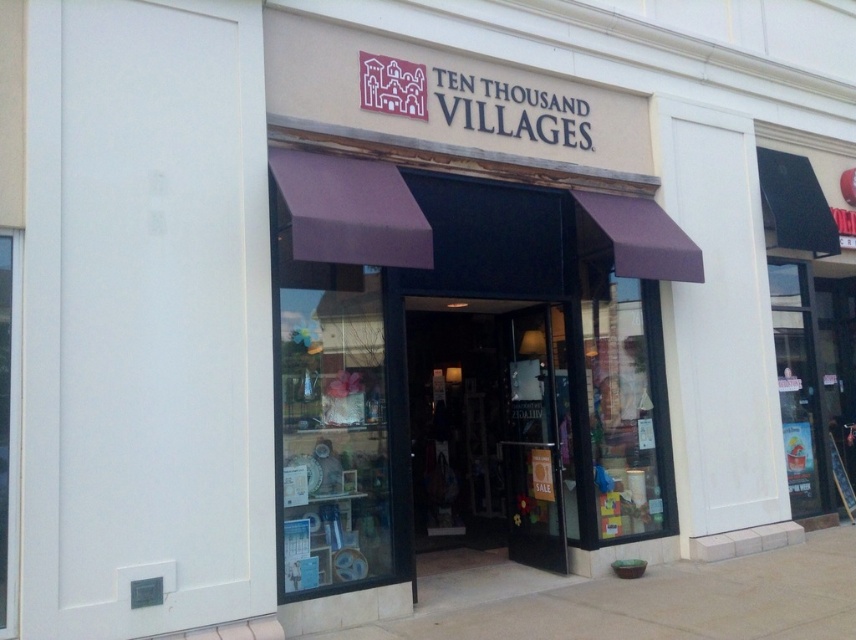
Looking at this image, does purple fabric awning at center have a greater height compared to transparent glass door at center?

Yes.

Is purple fabric awning at center closer to camera compared to transparent glass door at center?

Yes, it is.

Describe the element at coordinates (464, 365) in the screenshot. I see `purple fabric awning at center` at that location.

Locate an element on the screen. The width and height of the screenshot is (856, 640). purple fabric awning at center is located at coordinates (464, 365).